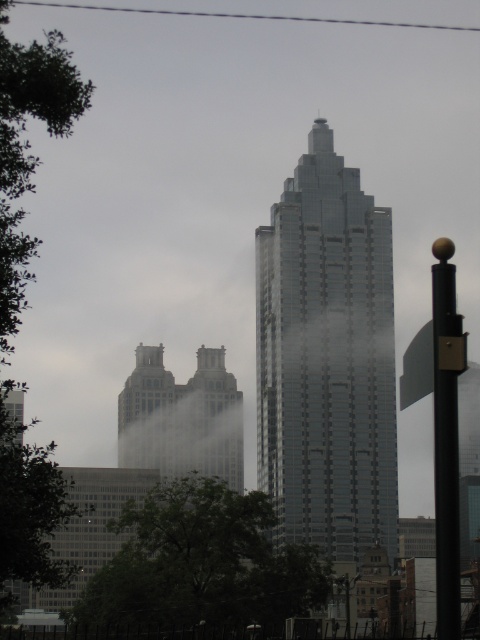
Based on the photo, based on the provided coordinates, which object corresponds to the point at (326, 358)?

The point at (326, 358) corresponds to the glassy steel skyscraper at center.

From the picture: You are standing at the center of the city and looking straight ahead. Which object from the list is located exactly at the coordinates point 0.562, 0.681? The options are the glassy steel skyscraper at center and the two classical buildings on the left.

The glassy steel skyscraper at center is located exactly at point (326, 358).

You are a city planner reviewing this area. You need to install a new streetlight that must be placed in front of the matte silver twin towers at center to ensure visibility. Is the current position of the black metal pole at right suitable for this purpose?

The black metal pole at right is behind the matte silver twin towers at center, so it cannot be used as a streetlight in front of them since it is obstructed by the towers.